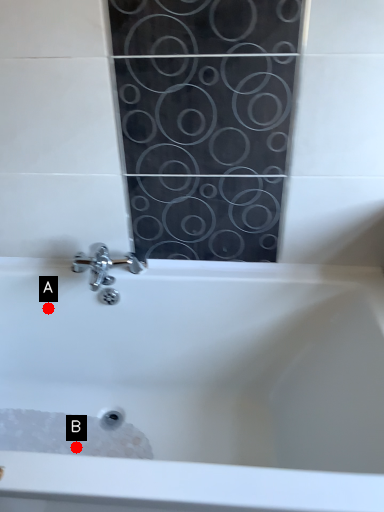
Question: Two points are circled on the image, labeled by A and B beside each circle. Which point is further to the camera?

Choices:
 (A) A is further
 (B) B is further

Answer: (A)